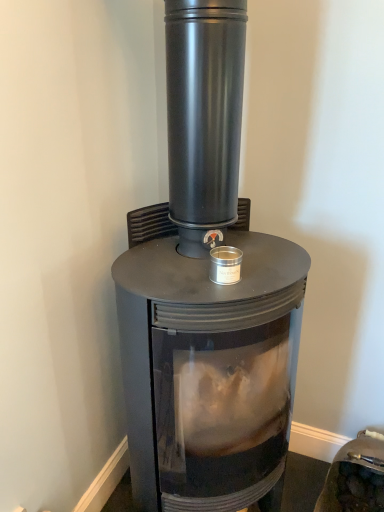
Question: Is black matte wood burning stove at center completely or partially inside matte black stove at center?

Choices:
 (A) yes
 (B) no

Answer: (B)

Question: Is matte black stove at center positioned with its back to black matte wood burning stove at center?

Choices:
 (A) no
 (B) yes

Answer: (A)

Question: Can you confirm if matte black stove at center is thinner than black matte wood burning stove at center?

Choices:
 (A) yes
 (B) no

Answer: (A)

Question: Can you confirm if matte black stove at center is shorter than black matte wood burning stove at center?

Choices:
 (A) no
 (B) yes

Answer: (B)

Question: From the image's perspective, is matte black stove at center located beneath black matte wood burning stove at center?

Choices:
 (A) yes
 (B) no

Answer: (A)

Question: Does matte black stove at center appear on the left side of black matte wood burning stove at center?

Choices:
 (A) no
 (B) yes

Answer: (A)

Question: Considering the relative positions of black matte wood burning stove at center and matte black stove at center in the image provided, is black matte wood burning stove at center to the left of matte black stove at center from the viewer's perspective?

Choices:
 (A) no
 (B) yes

Answer: (B)

Question: Is black matte wood burning stove at center surrounding matte black stove at center?

Choices:
 (A) no
 (B) yes

Answer: (A)

Question: From the image's perspective, does black matte wood burning stove at center appear higher than matte black stove at center?

Choices:
 (A) yes
 (B) no

Answer: (A)

Question: From a real-world perspective, is black matte wood burning stove at center located beneath matte black stove at center?

Choices:
 (A) no
 (B) yes

Answer: (A)

Question: Is black matte wood burning stove at center bigger than matte black stove at center?

Choices:
 (A) yes
 (B) no

Answer: (A)

Question: From the image's perspective, is black matte wood burning stove at center beneath matte black stove at center?

Choices:
 (A) no
 (B) yes

Answer: (A)

Question: Is black matte wood burning stove at center bigger or smaller than matte black stove at center?

Choices:
 (A) big
 (B) small

Answer: (A)